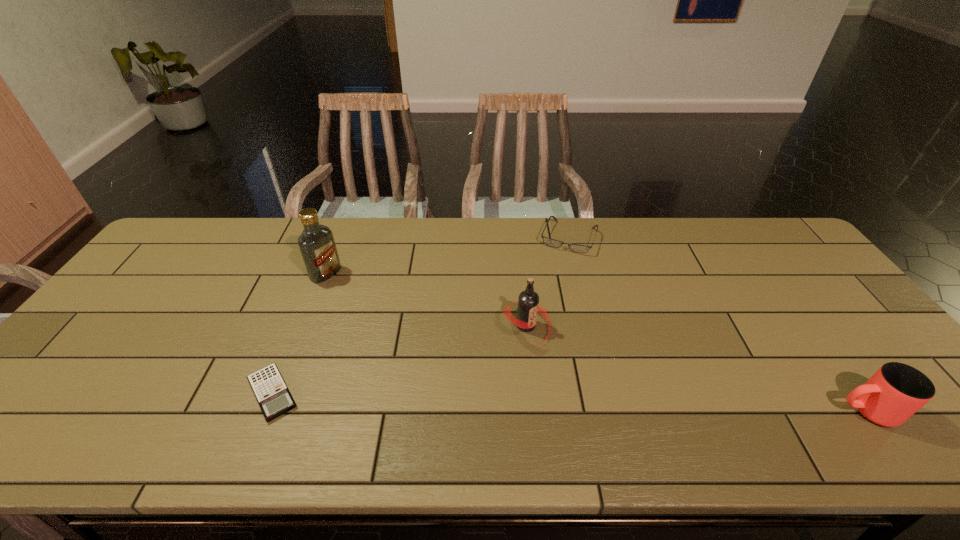
The width and height of the screenshot is (960, 540). What are the coordinates of `vacant spot on the desktop that is between the calculator and the rightmost object and is positioned on the front-facing side of the spectacles` in the screenshot? It's located at (506, 400).

Where is `free space on the desktop that is between the shortest object and the cup and is positioned on the label of the root beer`? The height and width of the screenshot is (540, 960). free space on the desktop that is between the shortest object and the cup and is positioned on the label of the root beer is located at coordinates (624, 403).

Locate an element on the screen. The height and width of the screenshot is (540, 960). free spot on the desktop that is between the calculator and the rightmost object and is positioned on the front-facing side of the vodka is located at coordinates (541, 401).